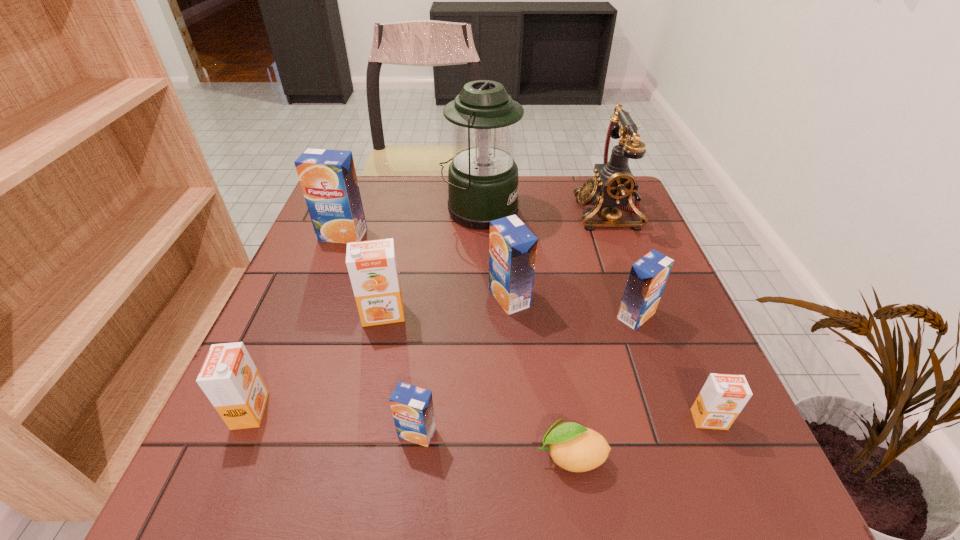
Find the location of a particular element. The height and width of the screenshot is (540, 960). the tallest object is located at coordinates (482, 181).

Find the location of a particular element. This screenshot has width=960, height=540. lantern is located at coordinates (482, 181).

Locate an element on the screen. The image size is (960, 540). black telephone is located at coordinates (614, 186).

This screenshot has height=540, width=960. I want to click on the ninth shortest object, so click(x=614, y=186).

Where is `the biggest blue orange_juice`? the biggest blue orange_juice is located at coordinates (328, 178).

Locate an element on the screen. the tallest orange juice is located at coordinates (328, 178).

You are a GUI agent. You are given a task and a screenshot of the screen. Output one action in this format:
    pyautogui.click(x=<x>, y=<y>)
    Task: Click on the third orange juice from right to left
    The image size is (960, 540).
    Given the screenshot: What is the action you would take?
    pyautogui.click(x=512, y=246)

This screenshot has height=540, width=960. Find the location of `the third blue orange_juice from left to right`. the third blue orange_juice from left to right is located at coordinates (512, 246).

What are the coordinates of `the third orange juice from left to right` in the screenshot? It's located at (372, 266).

This screenshot has height=540, width=960. I want to click on the third object from left to right, so click(372, 266).